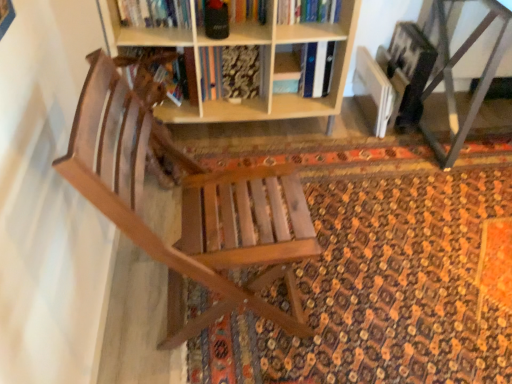
Where is `wooden chair at center`? The width and height of the screenshot is (512, 384). wooden chair at center is located at coordinates (190, 208).

The height and width of the screenshot is (384, 512). Find the location of `patterned carpet at center`. patterned carpet at center is located at coordinates (380, 272).

Where is `wooden chair at center`? This screenshot has height=384, width=512. wooden chair at center is located at coordinates (190, 208).

Between hardcover book at upper center and patterned carpet at center, which one has larger size?

patterned carpet at center.

Is point (317, 2) more distant than point (461, 349)?

Yes, point (317, 2) is behind point (461, 349).

Is hardcover book at upper center far from patterned carpet at center?

That's not correct — hardcover book at upper center is a little close to patterned carpet at center.

From a real-world perspective, does hardcover book at upper center stand above patterned carpet at center?

Yes, from a real-world perspective, hardcover book at upper center is above patterned carpet at center.

From a real-world perspective, is patterned carpet at center located beneath wooden chair at center?

Yes, from a real-world perspective, patterned carpet at center is under wooden chair at center.

Can you confirm if patterned carpet at center is positioned to the left of wooden chair at center?

No, patterned carpet at center is not to the left of wooden chair at center.

Based on the photo, is patterned carpet at center looking in the opposite direction of wooden chair at center?

That's not correct — patterned carpet at center is not looking away from wooden chair at center.

Considering the positions of objects metallic gray table at lower right and hardcover book at upper center in the image provided, who is in front, metallic gray table at lower right or hardcover book at upper center?

metallic gray table at lower right.

In the image, is metallic gray table at lower right on the left side or the right side of hardcover book at upper center?

metallic gray table at lower right is to the right of hardcover book at upper center.

Is metallic gray table at lower right next to hardcover book at upper center?

metallic gray table at lower right and hardcover book at upper center are clearly separated.

Which is behind, point (452, 136) or point (302, 0)?

The point (452, 136) is farther.

Which of these two, wooden bookshelf at upper center or metallic gray table at lower right, is thinner?

wooden bookshelf at upper center.

From the picture: From a real-world perspective, is wooden bookshelf at upper center on metallic gray table at lower right?

Actually, wooden bookshelf at upper center is physically below metallic gray table at lower right in the real world.

Is the depth of wooden bookshelf at upper center greater than that of metallic gray table at lower right?

Yes, wooden bookshelf at upper center is further from the camera.

Considering the sizes of hardcover book at upper center and metallic gray table at lower right in the image, is hardcover book at upper center bigger or smaller than metallic gray table at lower right?

In the image, hardcover book at upper center appears to be smaller than metallic gray table at lower right.

In the scene shown: Which is less distant, (291,12) or (456,51)?

The point (291,12) is more forward.

This screenshot has height=384, width=512. What are the coordinates of `book that appears on the left of metallic gray table at lower right` in the screenshot? It's located at (308, 11).

Is hardcover book at upper center not close to metallic gray table at lower right?

No, hardcover book at upper center is not far from metallic gray table at lower right.

Locate an element on the screen. The height and width of the screenshot is (384, 512). chair in front of the metallic gray table at lower right is located at coordinates (190, 208).

Which is more to the left, metallic gray table at lower right or wooden chair at center?

wooden chair at center.

Based on the photo, is metallic gray table at lower right wider than wooden chair at center?

Indeed, metallic gray table at lower right has a greater width compared to wooden chair at center.

Measure the distance from metallic gray table at lower right to wooden chair at center.

The distance of metallic gray table at lower right from wooden chair at center is 4.15 feet.

Which of these two, wooden bookshelf at upper center or patterned carpet at center, stands shorter?

Standing shorter between the two is patterned carpet at center.

Considering the sizes of objects wooden bookshelf at upper center and patterned carpet at center in the image provided, who is smaller, wooden bookshelf at upper center or patterned carpet at center?

patterned carpet at center is smaller.

Which object is further away from the camera, wooden bookshelf at upper center or patterned carpet at center?

wooden bookshelf at upper center is further from the camera.

In the scene shown: Is wooden bookshelf at upper center in contact with patterned carpet at center?

There is a gap between wooden bookshelf at upper center and patterned carpet at center.

Locate an element on the screen. doormat lying on the right of hardcover book at upper center is located at coordinates (380, 272).

This screenshot has width=512, height=384. Identify the location of chair that is above the patterned carpet at center (from a real-world perspective). (190, 208).

In the scene shown: From the image, which object appears to be farther from patterned carpet at center, hardcover book at upper center or wooden bookshelf at upper center?

hardcover book at upper center lies further to patterned carpet at center than the other object.

Which object lies nearer to the anchor point wooden bookshelf at upper center, hardcover book at upper center or wooden chair at center?

Among the two, hardcover book at upper center is located nearer to wooden bookshelf at upper center.

Considering their positions, is patterned carpet at center positioned further to metallic gray table at lower right than wooden bookshelf at upper center?

wooden bookshelf at upper center is positioned further to the anchor metallic gray table at lower right.

Considering their positions, is metallic gray table at lower right positioned closer to wooden bookshelf at upper center than patterned carpet at center?

The object closer to wooden bookshelf at upper center is patterned carpet at center.

Looking at the image, which one is located further to metallic gray table at lower right, wooden chair at center or patterned carpet at center?

Among the two, wooden chair at center is located further to metallic gray table at lower right.

Looking at the image, which one is located further to wooden bookshelf at upper center, wooden chair at center or hardcover book at upper center?

Based on the image, wooden chair at center appears to be further to wooden bookshelf at upper center.

Based on their spatial positions, is metallic gray table at lower right or patterned carpet at center further from hardcover book at upper center?

patterned carpet at center is further to hardcover book at upper center.

Estimate the real-world distances between objects in this image. Which object is further from metallic gray table at lower right, wooden chair at center or wooden bookshelf at upper center?

wooden chair at center is further to metallic gray table at lower right.

Where is `shelf that lies between hardcover book at upper center and patterned carpet at center from top to bottom`? The width and height of the screenshot is (512, 384). shelf that lies between hardcover book at upper center and patterned carpet at center from top to bottom is located at coordinates (264, 63).

You are a GUI agent. You are given a task and a screenshot of the screen. Output one action in this format:
    pyautogui.click(x=<x>, y=<y>)
    Task: Click on the shelf located between wooden chair at center and metallic gray table at lower right in the left-right direction
    The image size is (512, 384).
    Given the screenshot: What is the action you would take?
    pyautogui.click(x=264, y=63)

Where is `doormat between wooden chair at center and metallic gray table at lower right from left to right`? doormat between wooden chair at center and metallic gray table at lower right from left to right is located at coordinates (380, 272).

Identify the location of chair between wooden bookshelf at upper center and patterned carpet at center vertically. This screenshot has width=512, height=384. (190, 208).